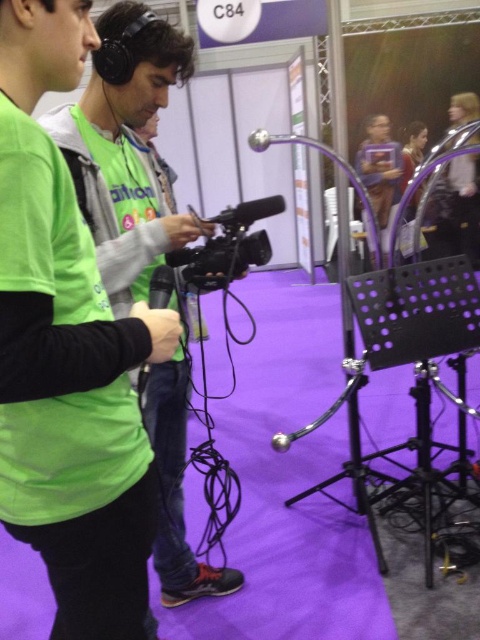
You are at a convention booth and need to position a new speaker to the right of the black plastic video camera at center. Where should you place the speaker relative to the green matte shirt at center?

Since the green matte shirt at center is to the left of the black plastic video camera at center, placing the speaker to the right of the black plastic video camera at center would mean positioning the speaker to the right of the green matte shirt at center as well.

You are a photographer at the event and want to take a picture of the green matte shirt at center and the black plastic video camera at center. Which object should you focus on first if you want to capture both in the same frame without moving the camera?

The green matte shirt at center is positioned under the black plastic video camera at center, so you should focus on the black plastic video camera at center first to ensure both are in focus.